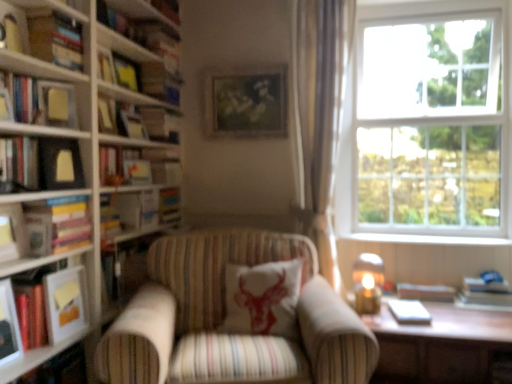
Question: Would you say wooden table at lower right is inside or outside hardcover book at upper left, the 6th book in the bottom-to-top sequence?

Choices:
 (A) outside
 (B) inside

Answer: (A)

Question: Considering the positions of wooden table at lower right and hardcover book at upper left, the 6th book in the bottom-to-top sequence, in the image, is wooden table at lower right taller or shorter than hardcover book at upper left, the 6th book in the bottom-to-top sequence,?

Choices:
 (A) tall
 (B) short

Answer: (A)

Question: Which object is the farthest from the striped fabric armchair at center?

Choices:
 (A) white wood at right
 (B) white matte paperback book at lower right, the 2th paperback book viewed from the top
 (C) matte yellow picture frame at upper left, which ranks as the 3th picture frame in back-to-front order
 (D) matte orange book at left, the 6th book viewed from the top
 (E) silky beige curtain at right

Answer: (A)

Question: Estimate the real-world distances between objects in this image. Which object is farther from the silky beige curtain at right?

Choices:
 (A) hardcover book at left, which is counted as the fourth book, starting from the top
 (B) hardcover book at left, marked as the 5th book in a bottom-to-top arrangement
 (C) white wood at right
 (D) matte orange book at left, which is the 2th book from bottom to top
 (E) matte black picture frame at left, acting as the 2th picture frame starting from the left

Answer: (D)